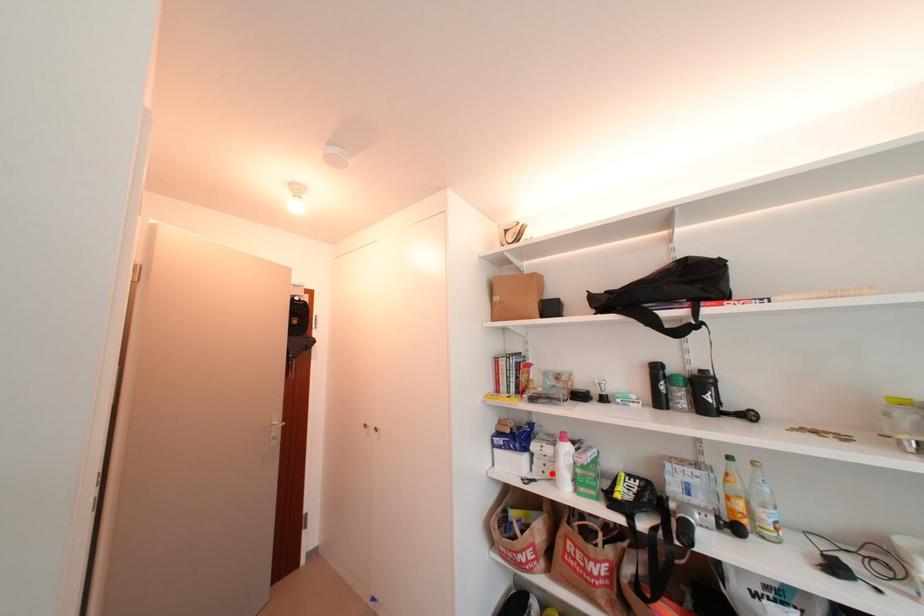
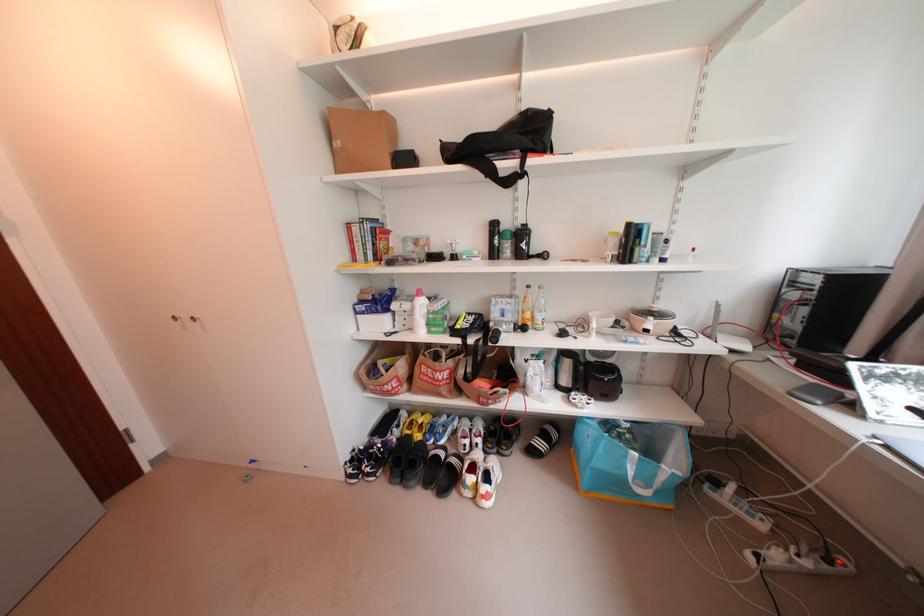
Where in the second image is the point corresponding to the highlighted location from the first image?

(412, 326)